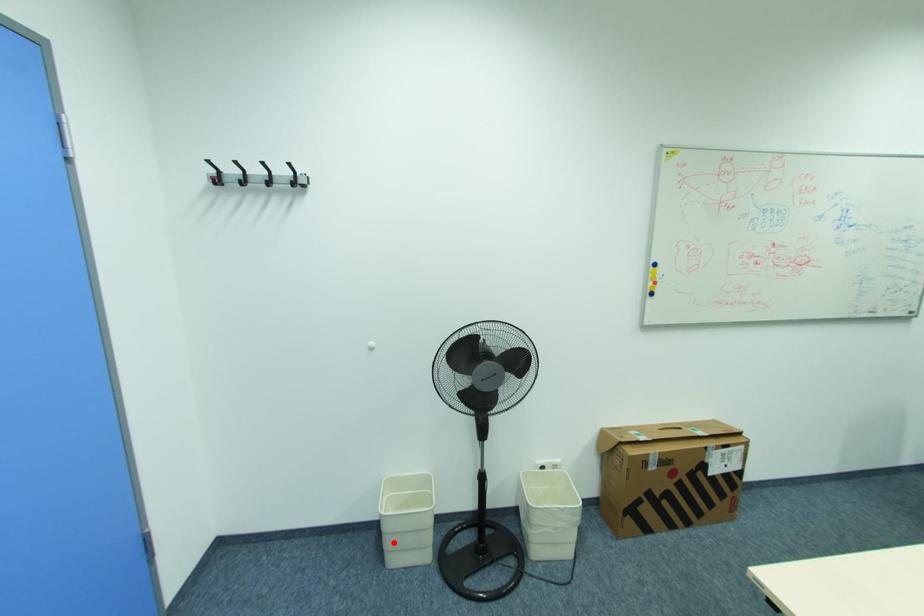
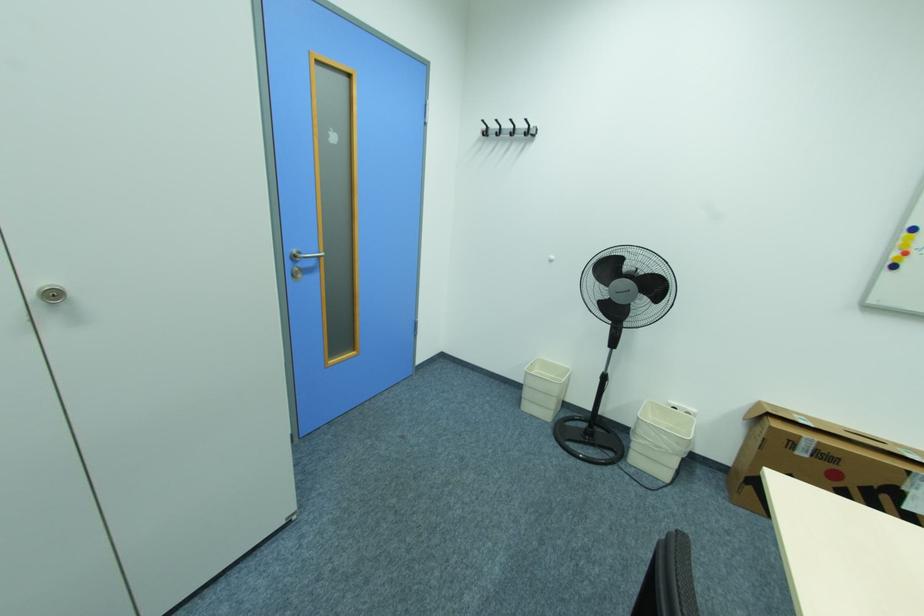
Question: I am providing you with two images of the same scene from different viewpoints. Image1 has a red point marked. In image2, the corresponding 3D location appears at what relative position? Reply with the corresponding letter.

Choices:
 (A) Closer
 (B) Farther

Answer: (A)